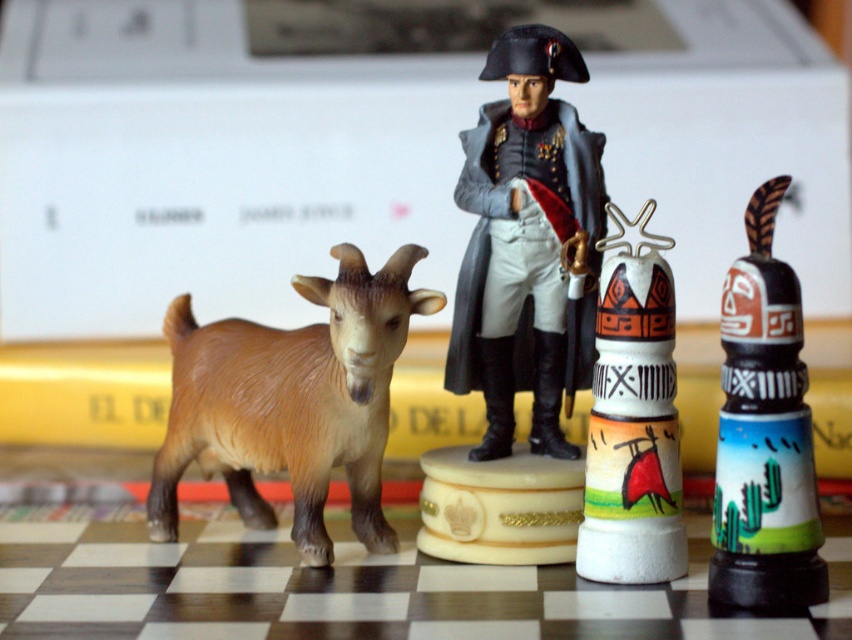
Between point (556, 266) and point (778, 202), which one is positioned in front?

Point (778, 202) is more forward.

At what (x,y) coordinates should I click in order to perform the action: click on matte gray figurine at center. Please return your answer as a coordinate pair (x, y). Looking at the image, I should click on (525, 243).

At what (x,y) coordinates should I click in order to perform the action: click on matte gray figurine at center. Please return your answer as a coordinate pair (x, y). The height and width of the screenshot is (640, 852). Looking at the image, I should click on (525, 243).

What are the coordinates of `matte gray figurine at center` in the screenshot? It's located at point(525,243).

Does brown matte goat at left appear over painted ceramic totem pole at right?

Actually, brown matte goat at left is below painted ceramic totem pole at right.

Based on the photo, can you confirm if brown matte goat at left is positioned to the right of painted ceramic totem pole at right?

Incorrect, brown matte goat at left is not on the right side of painted ceramic totem pole at right.

Find the location of a particular element. The width and height of the screenshot is (852, 640). brown matte goat at left is located at coordinates (291, 401).

Image resolution: width=852 pixels, height=640 pixels. I want to click on brown matte goat at left, so point(291,401).

Does matte gray figurine at center appear under white ceramic totem pole at center right?

Actually, matte gray figurine at center is above white ceramic totem pole at center right.

Does point (465, 188) lie in front of point (631, 356)?

No, it is behind (631, 356).

In order to click on matte gray figurine at center in this screenshot , I will do `click(525, 243)`.